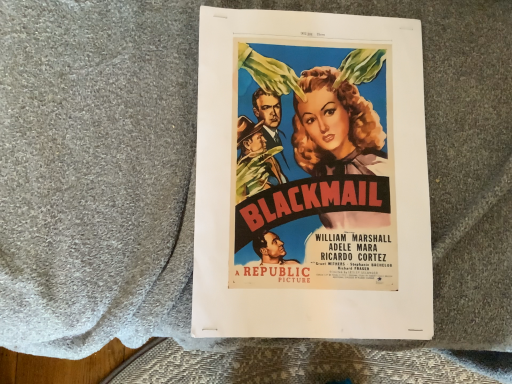
Question: Should I look upward or downward to see matte paper poster at center?

Choices:
 (A) up
 (B) down

Answer: (A)